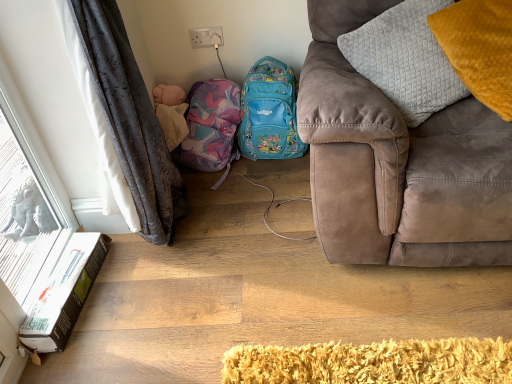
Locate an element on the screen. Image resolution: width=512 pixels, height=384 pixels. free space to the right of white cardboard box at lower left is located at coordinates (140, 293).